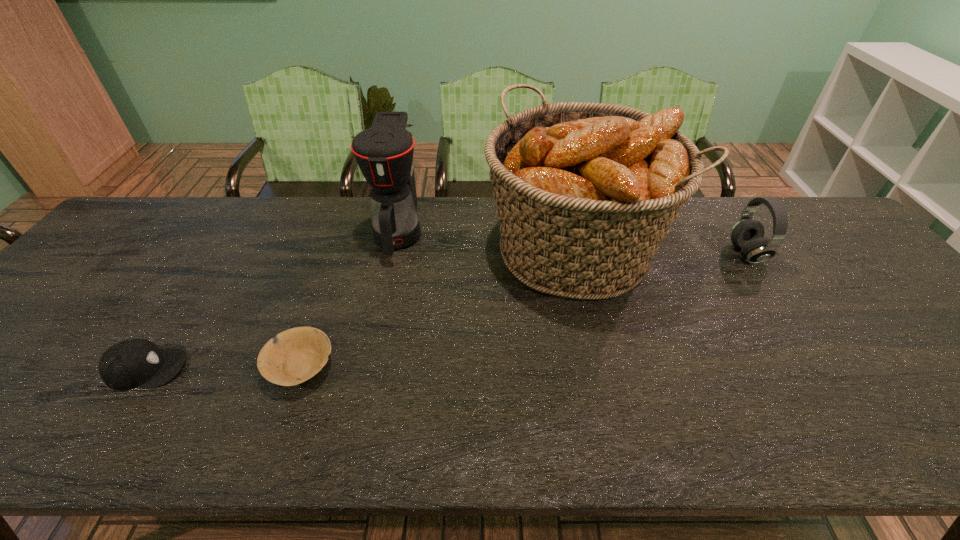
Locate an element on the screen. The height and width of the screenshot is (540, 960). empty location between the leftmost object and the shortest object is located at coordinates (224, 367).

Find the location of a particular element. The image size is (960, 540). object that stands as the second closest to the basket is located at coordinates (747, 235).

Choose which object is the second nearest neighbor to the shortest object. Please provide its 2D coordinates. Your answer should be formatted as a tuple, i.e. [(x, y)], where the tuple contains the x and y coordinates of a point satisfying the conditions above.

[(384, 152)]

This screenshot has height=540, width=960. I want to click on vacant space that satisfies the following two spatial constraints: 1. pour from the carafe of the fourth shortest object; 2. on the front-facing side of the leftmost object, so click(369, 369).

Identify the location of free space that satisfies the following two spatial constraints: 1. on the ear cups of the third shortest object; 2. on the front side of the bowl. The width and height of the screenshot is (960, 540). (821, 366).

This screenshot has height=540, width=960. Identify the location of free space that satisfies the following two spatial constraints: 1. on the front side of the bowl; 2. on the front-facing side of the leftmost object. (300, 369).

The height and width of the screenshot is (540, 960). What are the coordinates of `vacant space that satisfies the following two spatial constraints: 1. pour from the carafe of the coffee maker; 2. on the front-facing side of the leftmost object` in the screenshot? It's located at (369, 369).

At what (x,y) coordinates should I click in order to perform the action: click on free region that satisfies the following two spatial constraints: 1. pour from the carafe of the fourth shortest object; 2. on the left side of the tallest object. Please return your answer as a coordinate pair (x, y). The image size is (960, 540). Looking at the image, I should click on (395, 251).

Find the location of a particular element. Image resolution: width=960 pixels, height=540 pixels. vacant region that satisfies the following two spatial constraints: 1. pour from the carafe of the second tallest object; 2. on the left side of the tallest object is located at coordinates (395, 251).